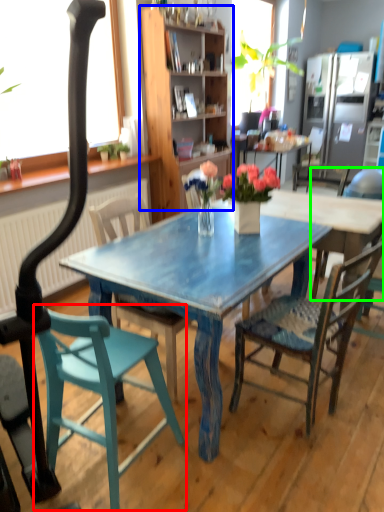
Question: Based on their relative distances, which object is farther from chair (highlighted by a red box)? Choose from cabinetry (highlighted by a blue box) and chair (highlighted by a green box).

Choices:
 (A) cabinetry
 (B) chair

Answer: (A)